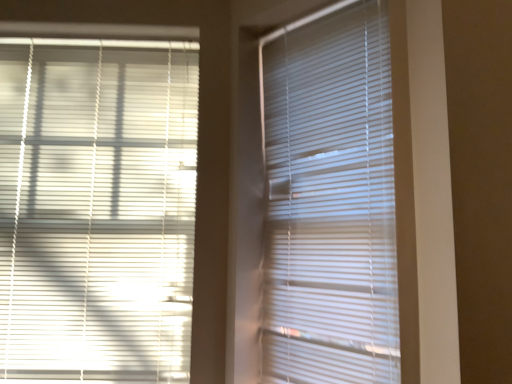
Question: Based on their sizes in the image, would you say white matte blinds at left, the 2th window blind from the right, is bigger or smaller than white matte window blind at center, acting as the first window blind starting from the right?

Choices:
 (A) small
 (B) big

Answer: (B)

Question: Visually, is white matte blinds at left, the 1th window blind viewed from the left, positioned to the left or to the right of white matte window blind at center, which is counted as the second window blind, starting from the left?

Choices:
 (A) right
 (B) left

Answer: (B)

Question: From a real-world perspective, relative to white matte window blind at center, which is counted as the second window blind, starting from the left, is white matte blinds at left, the 2th window blind from the right, vertically above or below?

Choices:
 (A) below
 (B) above

Answer: (A)

Question: Is white matte window blind at center, acting as the first window blind starting from the right, spatially inside white matte blinds at left, the 2th window blind from the right, or outside of it?

Choices:
 (A) outside
 (B) inside

Answer: (A)

Question: Based on their positions, is white matte window blind at center, which is counted as the second window blind, starting from the left, located to the left or right of white matte blinds at left, the 2th window blind from the right?

Choices:
 (A) right
 (B) left

Answer: (A)

Question: Considering the positions of white matte window blind at center, which is counted as the second window blind, starting from the left, and white matte blinds at left, the 2th window blind from the right, in the image, is white matte window blind at center, which is counted as the second window blind, starting from the left, taller or shorter than white matte blinds at left, the 2th window blind from the right,?

Choices:
 (A) tall
 (B) short

Answer: (B)

Question: Is white matte window blind at center, acting as the first window blind starting from the right, bigger or smaller than white matte blinds at left, the 2th window blind from the right?

Choices:
 (A) big
 (B) small

Answer: (B)